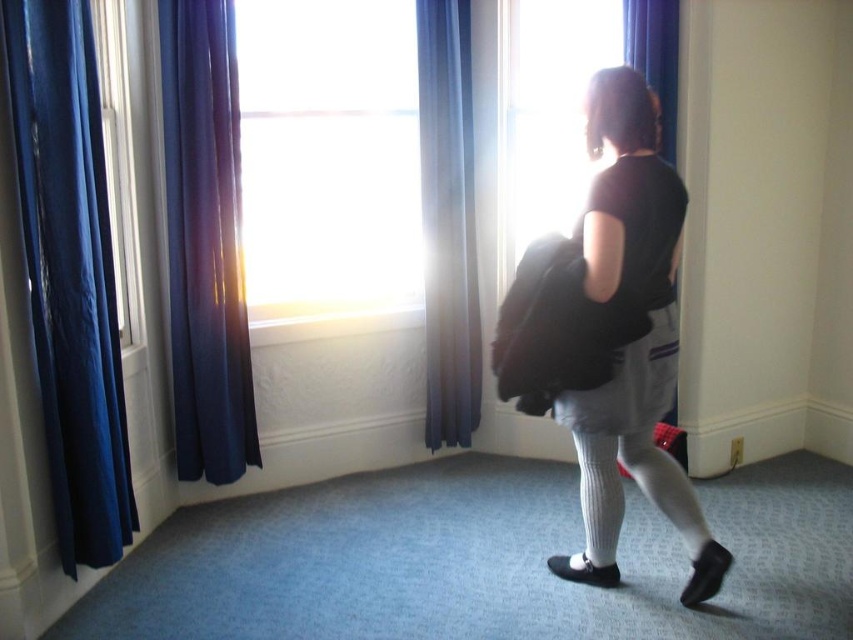
Who is higher up, transparent glass window at upper center or blue glossy curtain at left?

transparent glass window at upper center is higher up.

Between transparent glass window at upper center and blue glossy curtain at left, which one appears on the left side from the viewer's perspective?

blue glossy curtain at left

Does point (291, 177) come closer to viewer compared to point (119, 554)?

No, it is behind (119, 554).

Where is `transparent glass window at upper center`? Image resolution: width=853 pixels, height=640 pixels. transparent glass window at upper center is located at coordinates (329, 160).

Between transparent glass window at upper center and white knit tights at lower center, which one has less height?

white knit tights at lower center is shorter.

How far apart are transparent glass window at upper center and white knit tights at lower center?

The distance of transparent glass window at upper center from white knit tights at lower center is 4.93 feet.

Which is behind, point (274, 269) or point (640, 458)?

The point (274, 269) is more distant.

Image resolution: width=853 pixels, height=640 pixels. Find the location of `transparent glass window at upper center`. transparent glass window at upper center is located at coordinates (329, 160).

Does blue glossy curtain at left have a greater width compared to blue fabric curtain at center?

No, blue glossy curtain at left is not wider than blue fabric curtain at center.

Does blue glossy curtain at left come behind blue fabric curtain at center?

That is False.

This screenshot has height=640, width=853. I want to click on blue glossy curtain at left, so click(x=70, y=275).